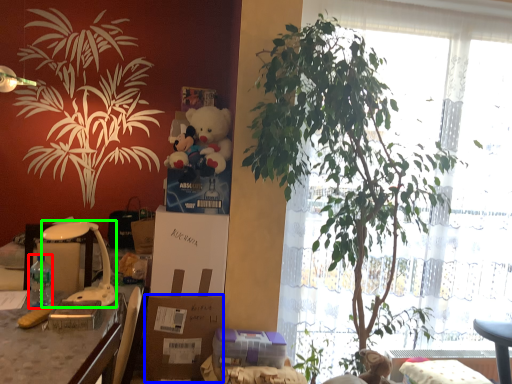
Question: Based on their relative distances, which object is farther from bottle (highlighted by a red box)? Choose from cardboard box (highlighted by a blue box) and lamp (highlighted by a green box).

Choices:
 (A) cardboard box
 (B) lamp

Answer: (A)